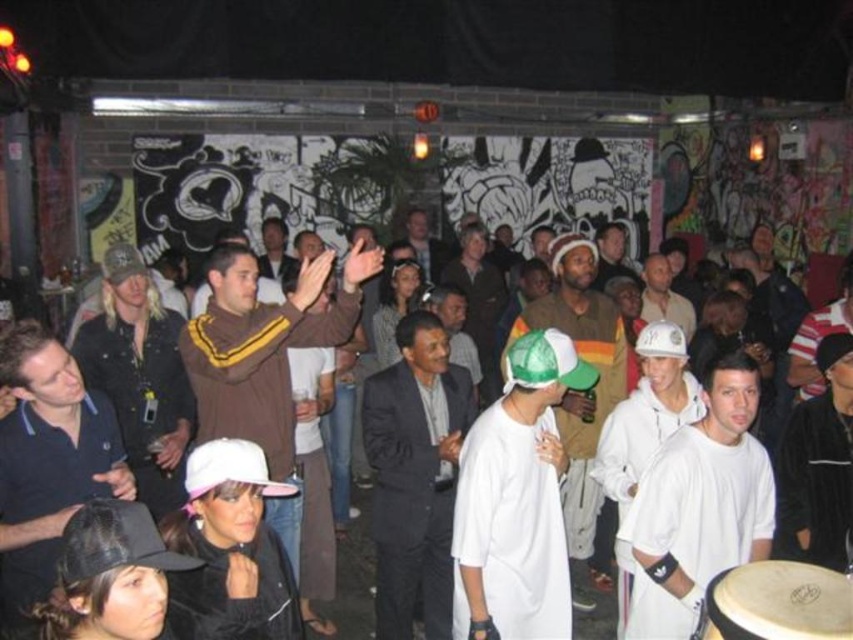
Can you confirm if dark blue polo shirt at center is positioned to the left of brown suede jacket at center?

No, dark blue polo shirt at center is not to the left of brown suede jacket at center.

Between point (108, 476) and point (279, 221), which one is positioned behind?

Point (279, 221)

The height and width of the screenshot is (640, 853). Identify the location of dark blue polo shirt at center. (47, 464).

Is white matte baseball cap at center bigger than brown suede jacket at center?

Correct, white matte baseball cap at center is larger in size than brown suede jacket at center.

Is point (582, 525) in front of point (271, 262)?

Yes.

Identify the location of white matte baseball cap at center. (579, 390).

Find the location of a particular element. This screenshot has height=640, width=853. white matte baseball cap at center is located at coordinates pyautogui.click(x=579, y=390).

Which is more to the right, dark gray suit at center or light brown leather jacket at center?

light brown leather jacket at center is more to the right.

Which of these two, dark gray suit at center or light brown leather jacket at center, stands shorter?

light brown leather jacket at center is shorter.

What are the coordinates of `dark gray suit at center` in the screenshot? It's located at (415, 476).